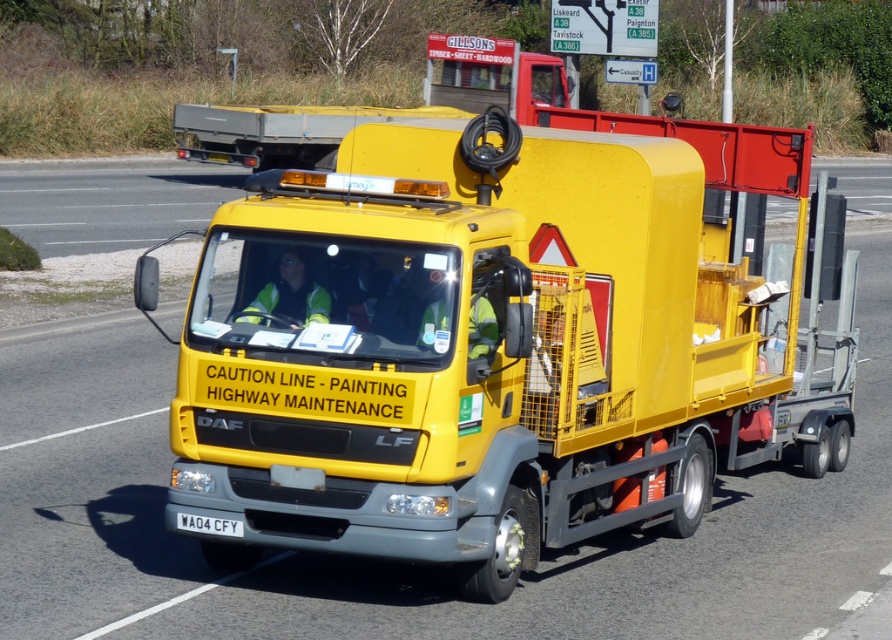
Locate an element on the screen. Image resolution: width=892 pixels, height=640 pixels. yellow matte truck at center is located at coordinates (486, 349).

In order to click on yellow matte truck at center in this screenshot , I will do `click(486, 349)`.